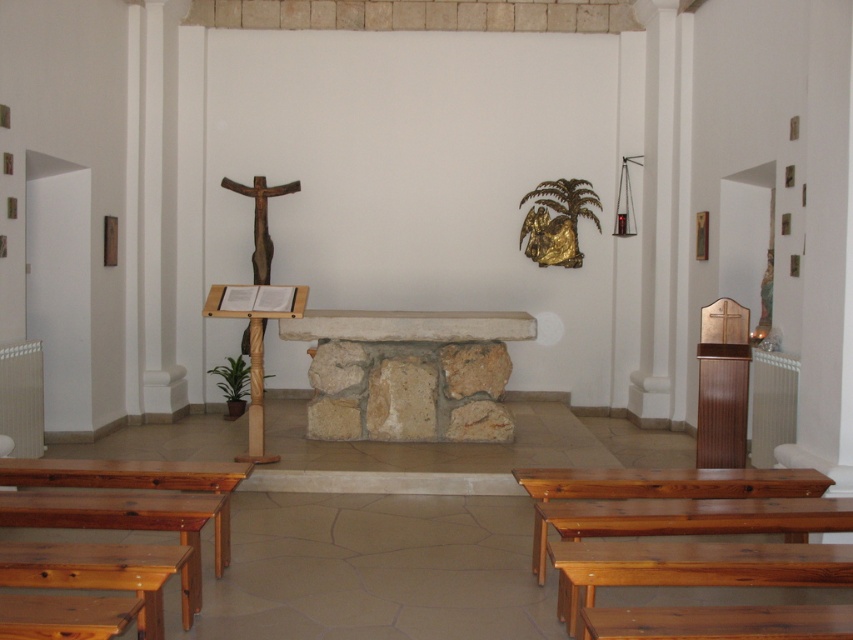
You are a visitor entering the church and need to sit down. You see the natural wood bench at lower left and the wooden crucifix at left. Which object is positioned to the right of the other?

The natural wood bench at lower left is to the right of the wooden crucifix at left.

You are a visitor entering the church and want to sit on the natural wood bench at lower left. However, there is a shiny brown wood bench at lower right in the way. Can you walk around it to reach your desired bench?

The natural wood bench at lower left is positioned over the shiny brown wood bench at lower right, meaning it is placed above it. Therefore, you can walk around the shiny brown wood bench at lower right to reach the natural wood bench at lower left since they are stacked vertically.